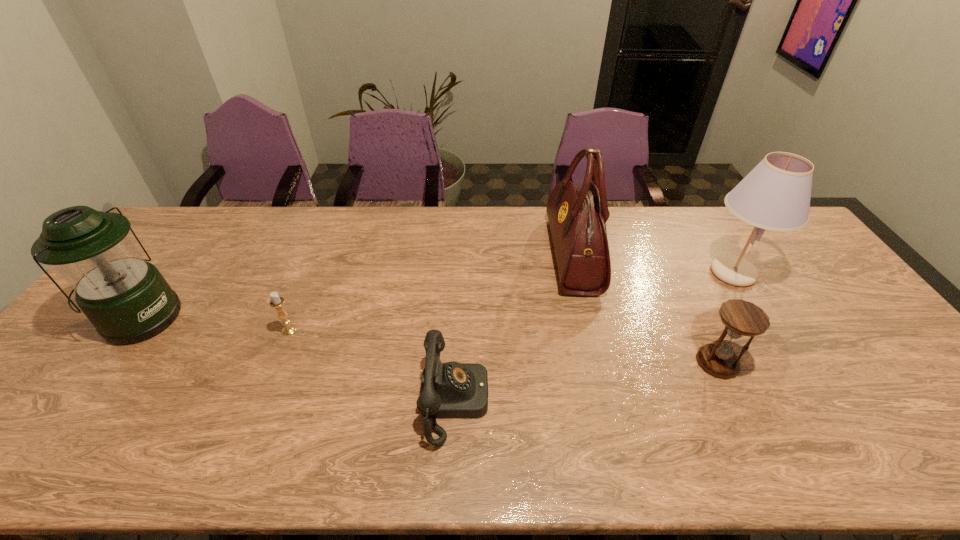
Find the location of `lampshade`. lampshade is located at coordinates (775, 195).

Where is `the third object from right to left`? the third object from right to left is located at coordinates (577, 215).

Find the location of a particular element. the leftmost object is located at coordinates (126, 298).

Locate an element on the screen. Image resolution: width=960 pixels, height=540 pixels. the second object from right to left is located at coordinates (741, 318).

This screenshot has height=540, width=960. In order to click on hourglass in this screenshot , I will do `click(741, 318)`.

I want to click on the second object from left to right, so click(276, 302).

Find the location of `telephone`. telephone is located at coordinates (448, 390).

You are a GUI agent. You are given a task and a screenshot of the screen. Output one action in this format:
    pyautogui.click(x=<x>, y=<y>)
    Task: Click on the vacant area located 0.060m on the right of the lampshade
    The width and height of the screenshot is (960, 540).
    Given the screenshot: What is the action you would take?
    pyautogui.click(x=786, y=273)

You are a GUI agent. You are given a task and a screenshot of the screen. Output one action in this format:
    pyautogui.click(x=<x>, y=<y>)
    Task: Click on the blank space located on the front-facing side of the handbag
    
    Given the screenshot: What is the action you would take?
    pyautogui.click(x=508, y=255)

I want to click on vacant area situated on the front-facing side of the handbag, so click(x=526, y=255).